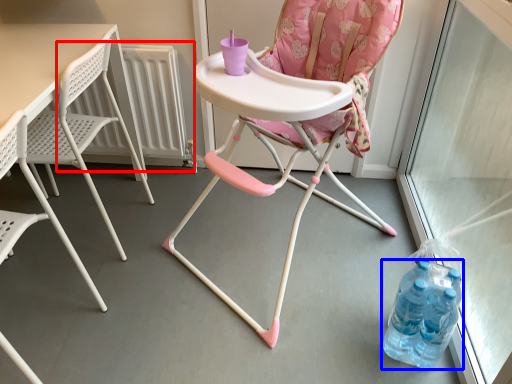
Question: Which object appears farthest to the camera in this image, radiator (highlighted by a red box) or bottle (highlighted by a blue box)?

Choices:
 (A) radiator
 (B) bottle

Answer: (A)